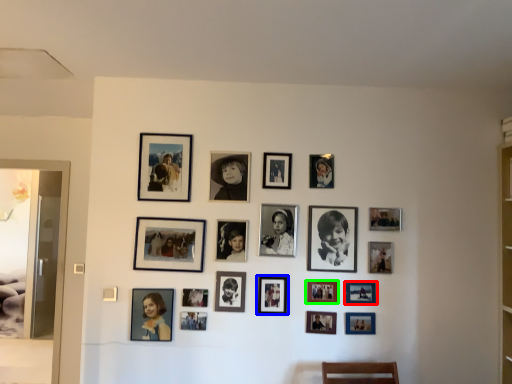
Question: Considering the real-world distances, which object is farthest from picture frame (highlighted by a red box)? picture frame (highlighted by a blue box) or picture frame (highlighted by a green box)?

Choices:
 (A) picture frame
 (B) picture frame

Answer: (A)